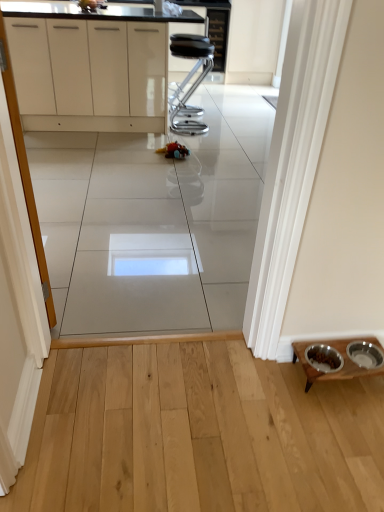
Question: Is white glossy cabinets at upper center aimed at black leather stool at center?

Choices:
 (A) no
 (B) yes

Answer: (A)

Question: Considering the relative sizes of white glossy cabinets at upper center and black leather stool at center in the image provided, is white glossy cabinets at upper center taller than black leather stool at center?

Choices:
 (A) no
 (B) yes

Answer: (B)

Question: Considering the relative sizes of white glossy cabinets at upper center and black leather stool at center in the image provided, is white glossy cabinets at upper center shorter than black leather stool at center?

Choices:
 (A) yes
 (B) no

Answer: (B)

Question: Is white glossy cabinets at upper center closer to camera compared to black leather stool at center?

Choices:
 (A) yes
 (B) no

Answer: (A)

Question: Is white glossy cabinets at upper center not within black leather stool at center?

Choices:
 (A) yes
 (B) no

Answer: (A)

Question: Is wooden table at lower right situated inside black leather stool at center or outside?

Choices:
 (A) inside
 (B) outside

Answer: (B)

Question: From their relative heights in the image, would you say wooden table at lower right is taller or shorter than black leather stool at center?

Choices:
 (A) tall
 (B) short

Answer: (B)

Question: Considering their positions, is wooden table at lower right located in front of or behind black leather stool at center?

Choices:
 (A) behind
 (B) front

Answer: (B)

Question: In terms of size, does wooden table at lower right appear bigger or smaller than black leather stool at center?

Choices:
 (A) small
 (B) big

Answer: (A)

Question: Is point (43, 267) positioned closer to the camera than point (173, 99)?

Choices:
 (A) farther
 (B) closer

Answer: (B)

Question: Considering their positions, is white glossy cabinet at left located in front of or behind black leather stool at center?

Choices:
 (A) front
 (B) behind

Answer: (A)

Question: Is white glossy cabinet at left bigger or smaller than black leather stool at center?

Choices:
 (A) big
 (B) small

Answer: (B)

Question: From a real-world perspective, is white glossy cabinet at left above or below black leather stool at center?

Choices:
 (A) above
 (B) below

Answer: (A)

Question: Is white glossy cabinets at upper center bigger or smaller than black leather stool at center?

Choices:
 (A) big
 (B) small

Answer: (A)

Question: From the image's perspective, is white glossy cabinets at upper center above or below black leather stool at center?

Choices:
 (A) below
 (B) above

Answer: (B)